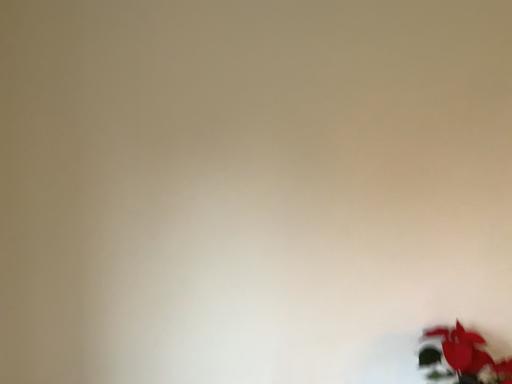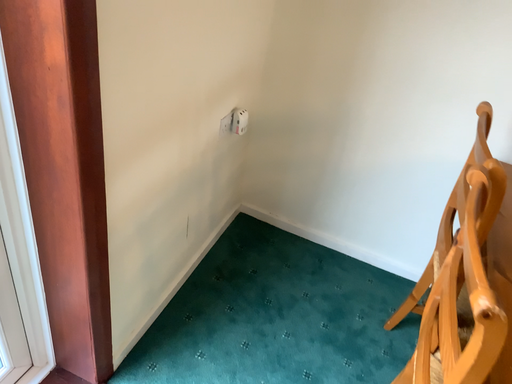
Question: Which way did the camera rotate in the video?

Choices:
 (A) rotated downward
 (B) rotated upward

Answer: (A)